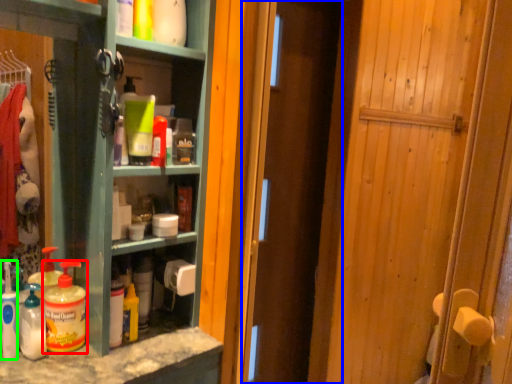
Question: Which is nearer to the bottle (highlighted by a red box)? door (highlighted by a blue box) or cleaning product (highlighted by a green box).

Choices:
 (A) door
 (B) cleaning product

Answer: (B)